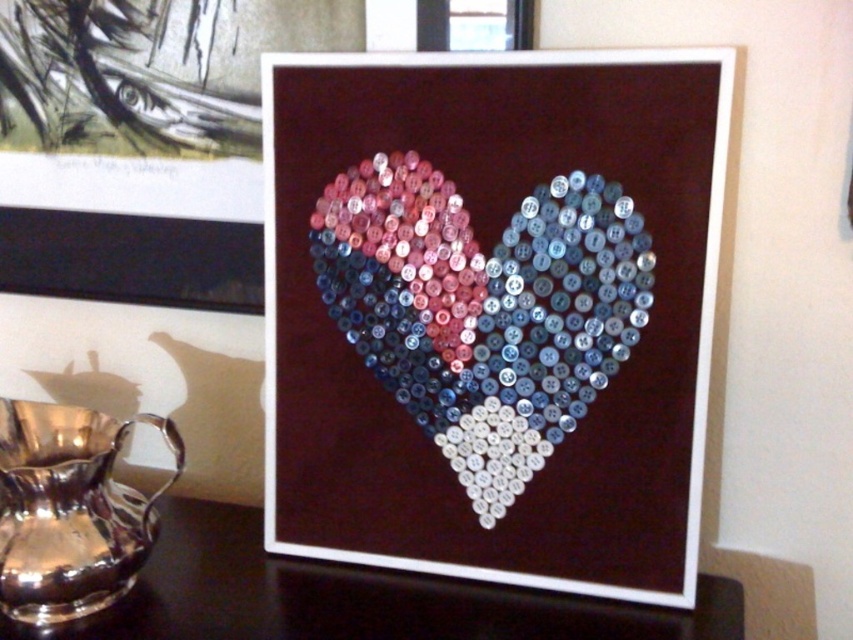
Question: Considering the relative positions of shiny plastic heart at center and shiny silver pitcher at lower left in the image provided, where is shiny plastic heart at center located with respect to shiny silver pitcher at lower left?

Choices:
 (A) above
 (B) below

Answer: (A)

Question: Is black glossy table at center further to the viewer compared to shiny silver pitcher at lower left?

Choices:
 (A) no
 (B) yes

Answer: (A)

Question: Which object appears farthest from the camera in this image?

Choices:
 (A) black glossy table at center
 (B) shiny plastic heart at center
 (C) shiny silver pitcher at lower left

Answer: (C)

Question: Which point is closer to the camera?

Choices:
 (A) black glossy table at center
 (B) shiny silver pitcher at lower left

Answer: (A)

Question: From the image, what is the correct spatial relationship of shiny plastic heart at center in relation to black glossy table at center?

Choices:
 (A) right
 (B) left

Answer: (A)

Question: Estimate the real-world distances between objects in this image. Which object is farther from the black glossy table at center?

Choices:
 (A) shiny silver pitcher at lower left
 (B) shiny plastic heart at center

Answer: (B)